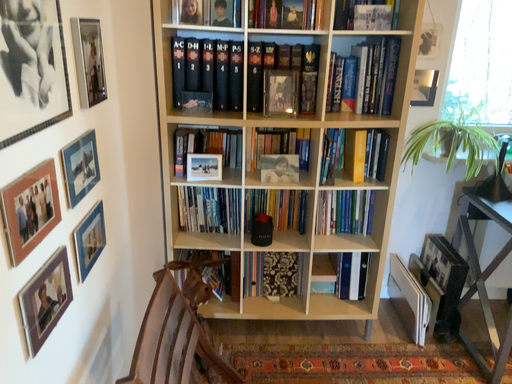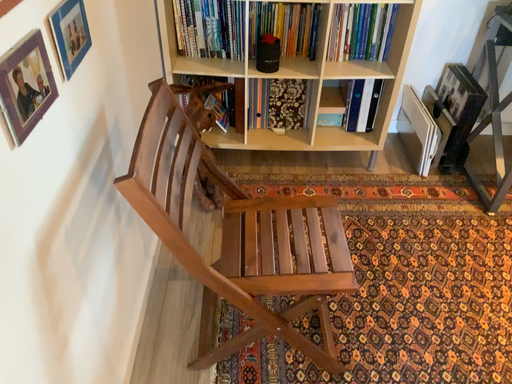
Question: How did the camera likely rotate when shooting the video?

Choices:
 (A) rotated downward
 (B) rotated upward

Answer: (A)